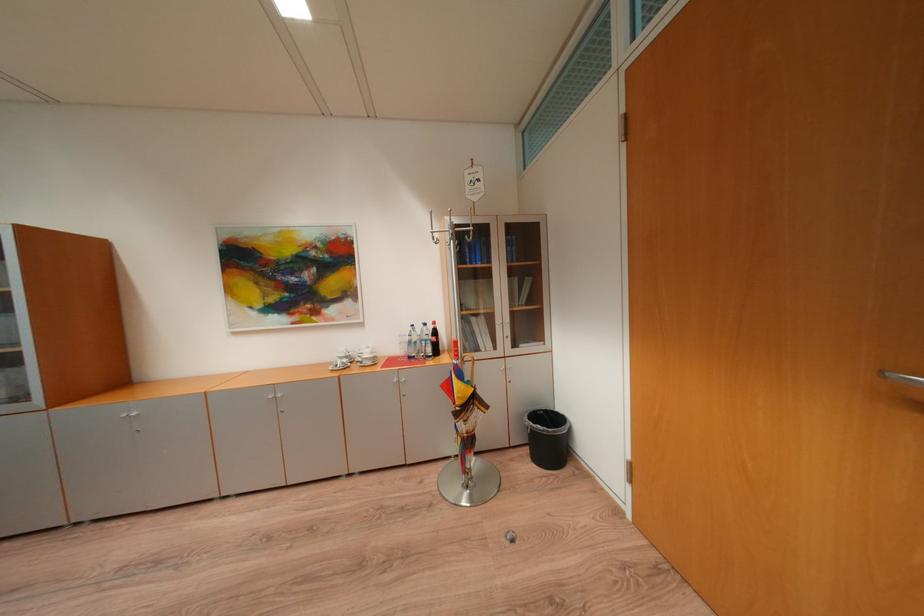
I want to click on silver door handle, so click(x=902, y=378).